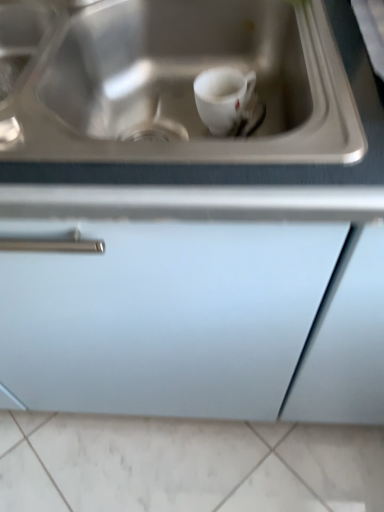
Question: From the image's perspective, would you say white marble tile at lower center is positioned over white glossy mug at center?

Choices:
 (A) yes
 (B) no

Answer: (B)

Question: Does white marble tile at lower center have a lesser height compared to white glossy mug at center?

Choices:
 (A) no
 (B) yes

Answer: (B)

Question: Considering the relative sizes of white marble tile at lower center and white glossy mug at center in the image provided, is white marble tile at lower center smaller than white glossy mug at center?

Choices:
 (A) no
 (B) yes

Answer: (A)

Question: Is there a large distance between white marble tile at lower center and white glossy mug at center?

Choices:
 (A) yes
 (B) no

Answer: (B)

Question: Is white marble tile at lower center next to white glossy mug at center?

Choices:
 (A) yes
 (B) no

Answer: (B)

Question: Can you confirm if white marble tile at lower center is taller than white glossy mug at center?

Choices:
 (A) no
 (B) yes

Answer: (A)

Question: Is stainless steel sink at upper center taller than white glossy mug at center?

Choices:
 (A) no
 (B) yes

Answer: (B)

Question: Is stainless steel sink at upper center further to the viewer compared to white glossy mug at center?

Choices:
 (A) no
 (B) yes

Answer: (A)

Question: From the image's perspective, would you say stainless steel sink at upper center is shown under white glossy mug at center?

Choices:
 (A) no
 (B) yes

Answer: (B)

Question: Is stainless steel sink at upper center facing away from white glossy mug at center?

Choices:
 (A) yes
 (B) no

Answer: (A)

Question: From a real-world perspective, is stainless steel sink at upper center located higher than white glossy mug at center?

Choices:
 (A) no
 (B) yes

Answer: (B)

Question: Does stainless steel sink at upper center have a larger size compared to white glossy mug at center?

Choices:
 (A) no
 (B) yes

Answer: (B)

Question: Is stainless steel sink at upper center to the right of white marble tile at lower center from the viewer's perspective?

Choices:
 (A) yes
 (B) no

Answer: (B)